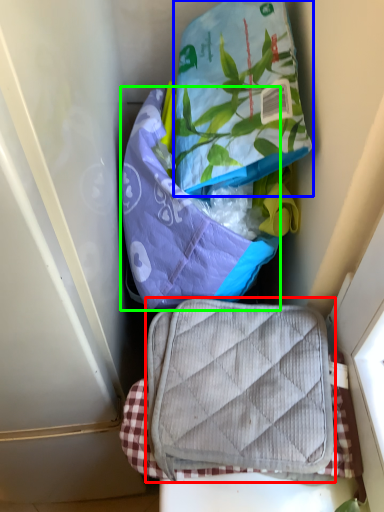
Question: Based on their relative distances, which object is farther from luggage and bags (highlighted by a red box)? Choose from pouch (highlighted by a blue box) and pouch (highlighted by a green box).

Choices:
 (A) pouch
 (B) pouch

Answer: (A)